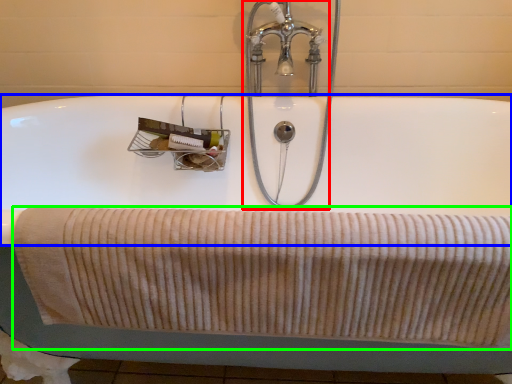
Question: Estimate the real-world distances between objects in this image. Which object is farther from tap (highlighted by a red box), bath (highlighted by a blue box) or bath towel (highlighted by a green box)?

Choices:
 (A) bath
 (B) bath towel

Answer: (B)